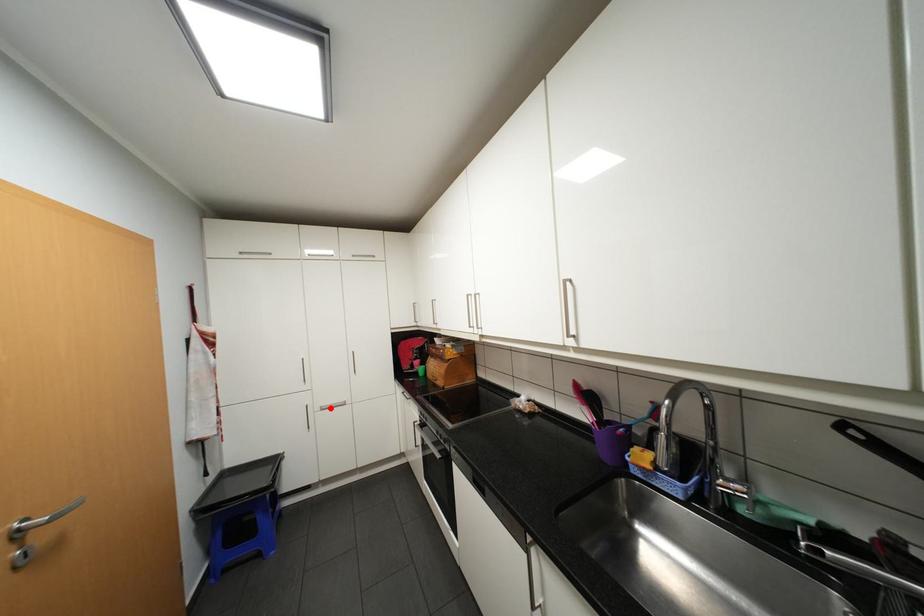
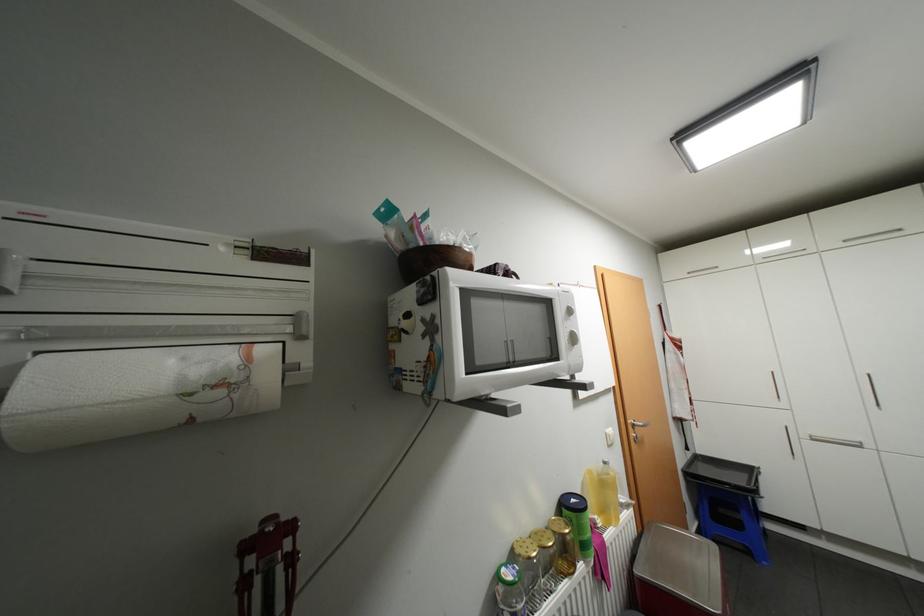
Question: I am providing you with two images of the same scene from different viewpoints. A red point is marked on the first image. At the location where the point appears in image 1, is it still visible in image 2?

Choices:
 (A) Yes
 (B) No

Answer: (A)